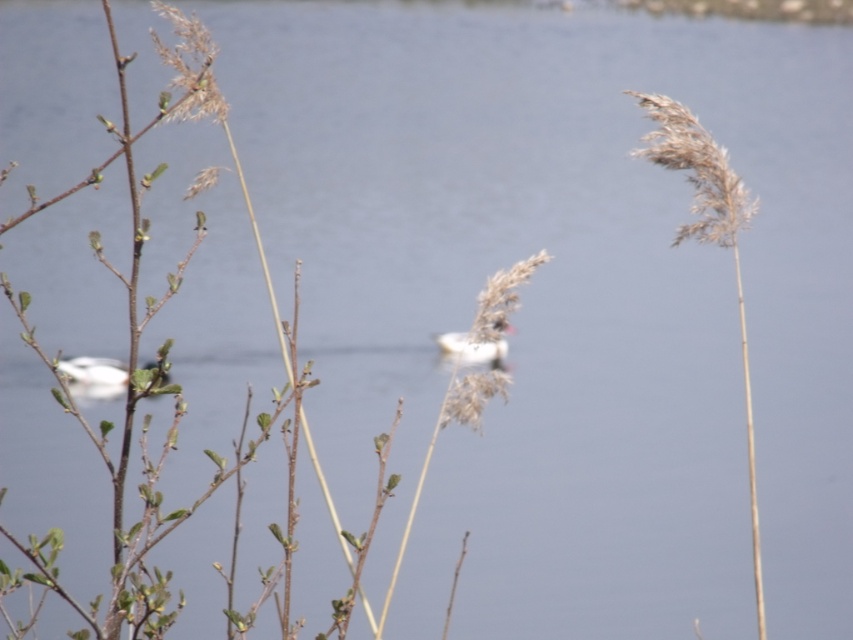
You are standing at the lakeside and want to take a photo of both the reeds and the birds. The reeds are at point [99,364] and the birds are at point [440,339]. Which point should you focus on first to ensure both are in focus?

You should focus on point [99,364] first because it is closer to the camera than point [440,339]. By focusing on the closer point, the birds at the farther point will still be within the depth of field and in focus.

You are an observer standing at the lakeside. You see a white matte boat at left and a white fluffy bird at center. Which object appears larger in the image?

The white fluffy bird at center appears larger than the white matte boat at left in the image.